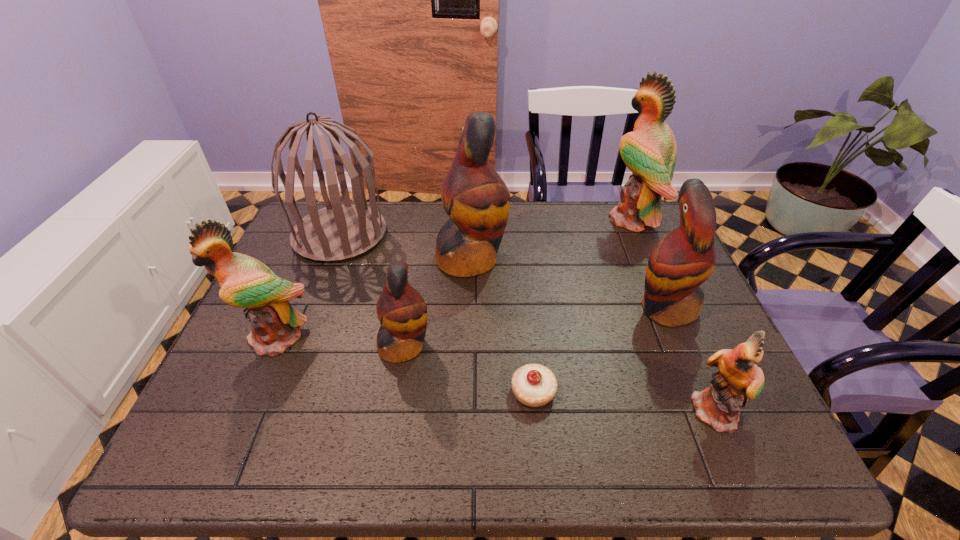
Locate an element on the screen. the farthest green parrot is located at coordinates (649, 152).

You are a GUI agent. You are given a task and a screenshot of the screen. Output one action in this format:
    pyautogui.click(x=<x>, y=<y>)
    Task: Click on the biggest green parrot
    Image resolution: width=960 pixels, height=540 pixels.
    Given the screenshot: What is the action you would take?
    pyautogui.click(x=649, y=152)

Identify the location of the farthest red parrot. (476, 199).

Where is `the second farthest parrot`? the second farthest parrot is located at coordinates (476, 199).

Locate an element on the screen. This screenshot has width=960, height=540. brown birdcage is located at coordinates (338, 232).

You are a GUI agent. You are given a task and a screenshot of the screen. Output one action in this format:
    pyautogui.click(x=<x>, y=<y>)
    Task: Click on the second nearest red parrot
    The width and height of the screenshot is (960, 540).
    Given the screenshot: What is the action you would take?
    pyautogui.click(x=682, y=260)

The width and height of the screenshot is (960, 540). I want to click on the rightmost red parrot, so click(x=682, y=260).

Identify the location of the second farthest green parrot. (245, 282).

At what (x,y) coordinates should I click in order to perform the action: click on the leftmost green parrot. Please return your answer as a coordinate pair (x, y). Looking at the image, I should click on (245, 282).

Image resolution: width=960 pixels, height=540 pixels. Identify the location of the smallest red parrot. 402,312.